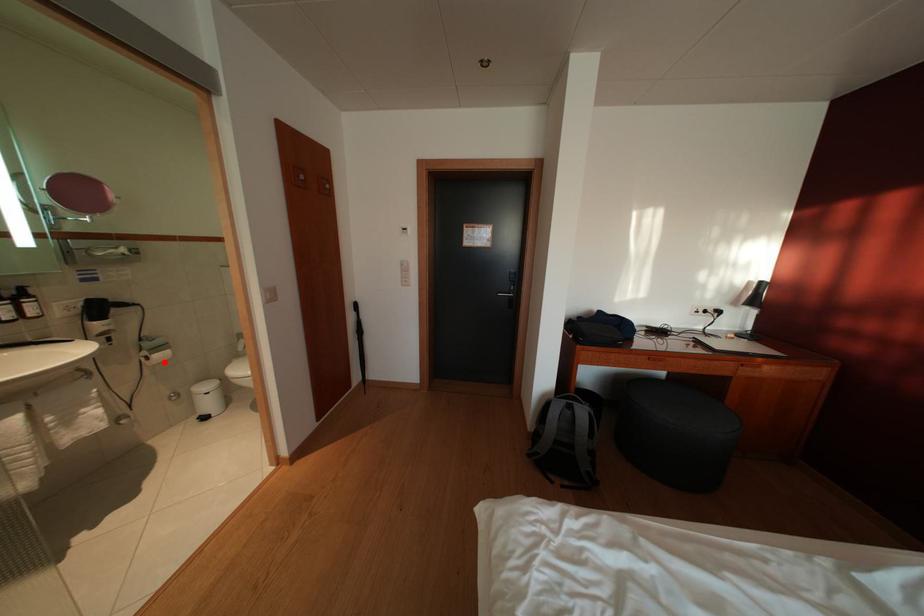
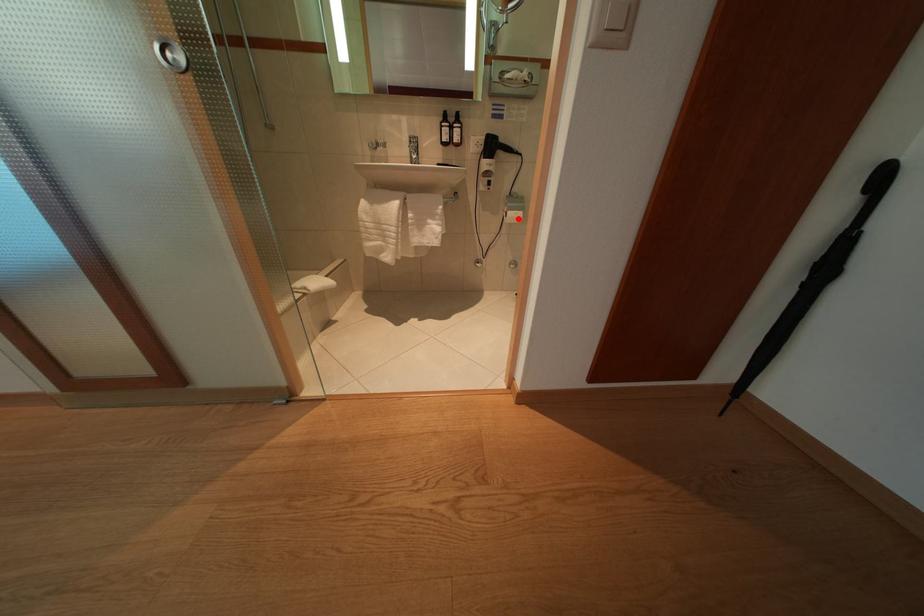
I am providing you with two images of the same scene from different viewpoints. A red point is marked on the first image and another point is marked on the second image. Is the marked point in image1 the same physical position as the marked point in image2?

Yes